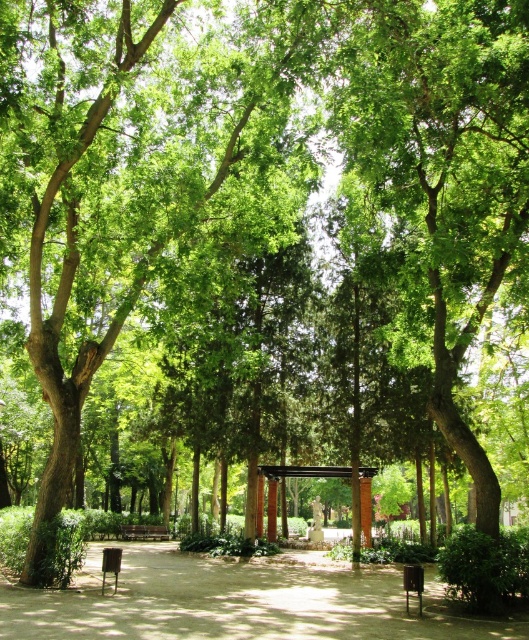
Which is more to the right, brown dirt path at center or brown wooden bench at center?

Positioned to the right is brown dirt path at center.

At what (x,y) coordinates should I click in order to perform the action: click on brown dirt path at center. Please return your answer as a coordinate pair (x, y). Looking at the image, I should click on (236, 602).

Where is `brown dirt path at center`? The height and width of the screenshot is (640, 529). brown dirt path at center is located at coordinates (236, 602).

Is brown dirt path at center in front of brown wooden pergola at center?

That is True.

Can you confirm if brown dirt path at center is bigger than brown wooden pergola at center?

Yes, brown dirt path at center is bigger than brown wooden pergola at center.

Which is in front, point (316, 573) or point (273, 493)?

Point (316, 573) is more forward.

Find the location of `brown dirt path at center`. brown dirt path at center is located at coordinates (236, 602).

Between brown wooden pergola at center and brown wooden bench at center, which one appears on the right side from the viewer's perspective?

From the viewer's perspective, brown wooden pergola at center appears more on the right side.

Does brown wooden pergola at center appear on the left side of brown wooden bench at center?

Incorrect, brown wooden pergola at center is not on the left side of brown wooden bench at center.

Describe the element at coordinates (304, 472) in the screenshot. I see `brown wooden pergola at center` at that location.

I want to click on brown wooden pergola at center, so (304, 472).